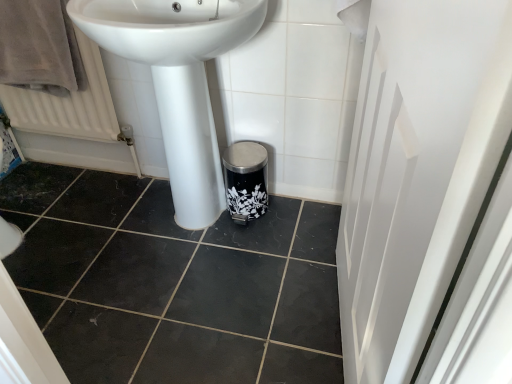
Question: In terms of height, does white glossy sink at center look taller or shorter compared to white glossy screen door at right?

Choices:
 (A) short
 (B) tall

Answer: (A)

Question: Is white glossy sink at center to the left or to the right of white glossy screen door at right in the image?

Choices:
 (A) left
 (B) right

Answer: (A)

Question: Estimate the real-world distances between objects in this image. Which object is closer to the brown velvety bath towel at upper left?

Choices:
 (A) white glossy screen door at right
 (B) white textured radiator at left
 (C) white glossy sink at center

Answer: (B)

Question: Which object is the closest to the white glossy screen door at right?

Choices:
 (A) white textured radiator at left
 (B) white glossy sink at center
 (C) brown velvety bath towel at upper left

Answer: (B)